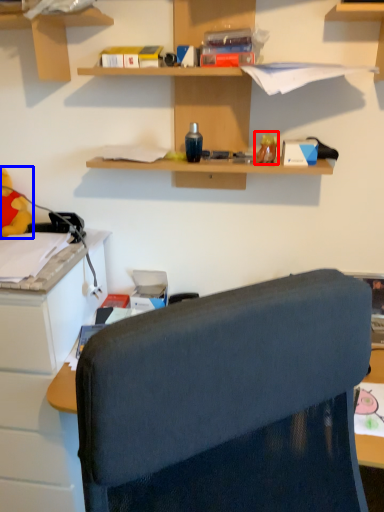
Question: Which point is closer to the camera, toy (highlighted by a red box) or toy (highlighted by a blue box)?

Choices:
 (A) toy
 (B) toy

Answer: (A)